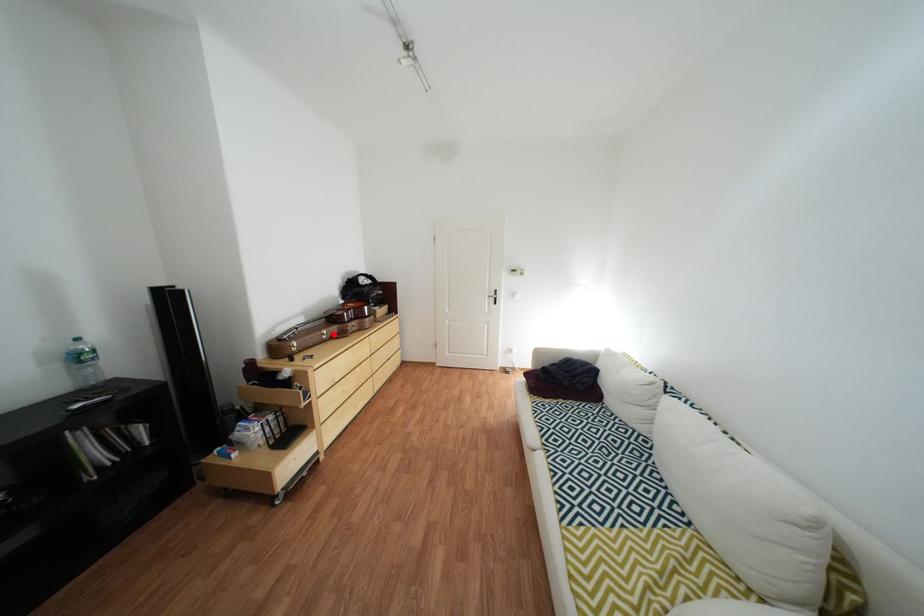
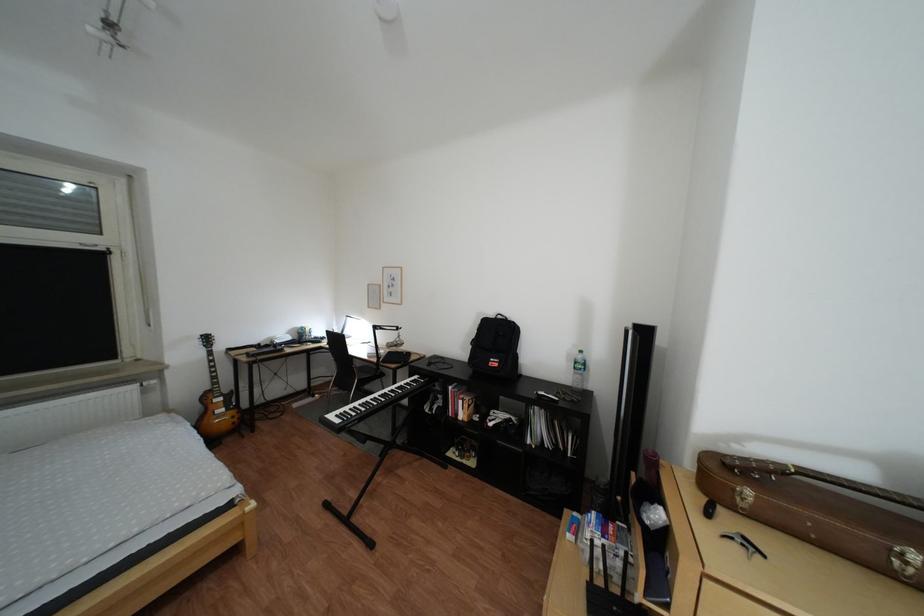
The point at the highlighted location is marked in the first image. Where is the corresponding point in the second image?

(885, 537)